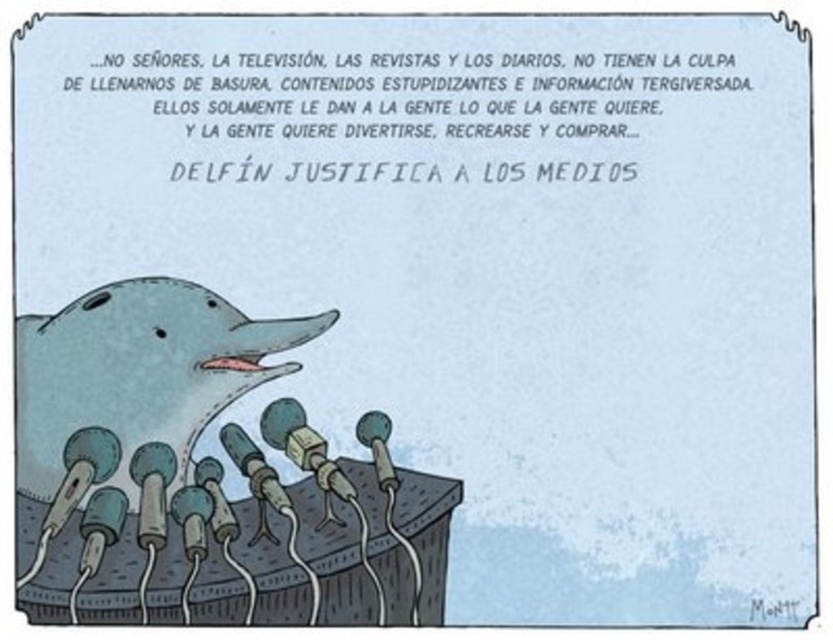
You are a sound technician setting up for a dolphin interview. You have two microphones, the matte gray microphone at center and the metallic gray microphone at center. Which microphone should you choose to ensure it can capture the dolphin from a wider area?

The matte gray microphone at center might be wider than metallic gray microphone at center, so you should choose the matte gray microphone at center to capture the dolphin from a wider area.

You are standing at the point labeled point (x=153, y=342) and want to take a photo of the dolphin. The camera you have can only focus on objects within 1.5 meters. Will the dolphin be in focus?

The distance between point (x=153, y=342) and the camera is 1.60 meters, which is beyond the camera focus range of 1.5 meters. Therefore, the dolphin will not be in focus.

You are an observer looking at the image. There are two points marked in the scene. The first point is at coordinate point (28, 442) and the second is at point (377, 464). Which point is closer to you?

Point (28, 442) is closer to the viewer than point (377, 464).